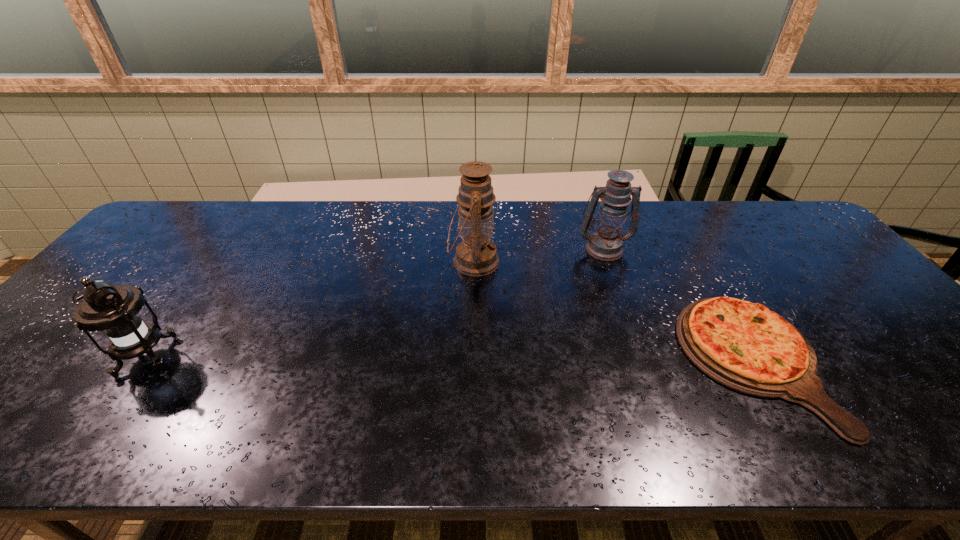
Locate an element on the screen. The width and height of the screenshot is (960, 540). empty location between the farther lantern and the rightmost object is located at coordinates (679, 305).

Where is `unoccupied position between the second object from left to right and the right lantern`? unoccupied position between the second object from left to right and the right lantern is located at coordinates (539, 255).

Identify the location of free space between the second object from right to left and the pizza. (679, 305).

Locate an element on the screen. This screenshot has height=540, width=960. free space between the second object from right to left and the left lantern is located at coordinates pos(374,303).

This screenshot has height=540, width=960. What are the coordinates of `free spot between the left lantern and the second object from left to right` in the screenshot? It's located at [x=309, y=309].

Image resolution: width=960 pixels, height=540 pixels. Find the location of `free space between the shortest object and the left lantern`. free space between the shortest object and the left lantern is located at coordinates (449, 360).

Find the location of a particular element. The image size is (960, 540). empty location between the left lantern and the third object from left to right is located at coordinates (374, 303).

This screenshot has height=540, width=960. In order to click on vacant region between the third object from left to right and the third object from right to left in this screenshot , I will do `click(539, 255)`.

Where is `vacant space in between the oil lamp and the leftmost object`? This screenshot has width=960, height=540. vacant space in between the oil lamp and the leftmost object is located at coordinates (309, 309).

Locate an element on the screen. Image resolution: width=960 pixels, height=540 pixels. vacant area that lies between the shortest object and the third object from right to left is located at coordinates (613, 312).